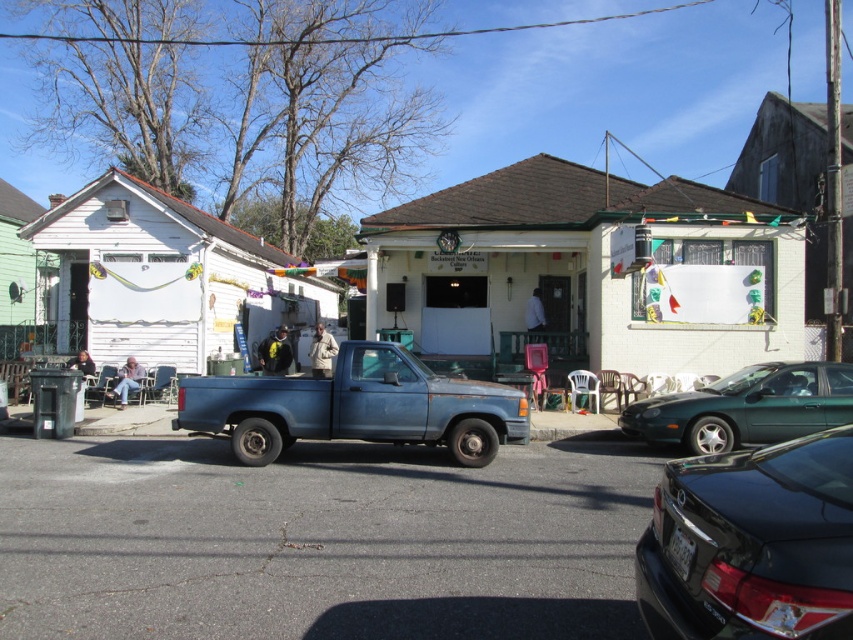
You are a delivery driver who needs to park your vehicle between the rusty blue pickup truck at center and the green matte car at center. Is there enough space for your 2.5 meter long delivery van?

The rusty blue pickup truck at center is to the left of green matte car at center, but the exact distance between them isn not provided. Without knowing the space between the two vehicles, it is impossible to determine if the 2.5 meter long delivery van can fit.

You are standing at the edge of the road and want to cross to the small white building with a dark roof. There is a blue pickup truck parked in front of you and a black glossy sedan at lower right. Can you safely cross the road without passing between the two vehicles?

The black glossy sedan at lower right is 2.47 meters away from viewer. Since the distance between the viewer and the sedan is 2.47 meters, it is possible to cross the road safely by staying close to the curb and avoiding the area between the two vehicles.